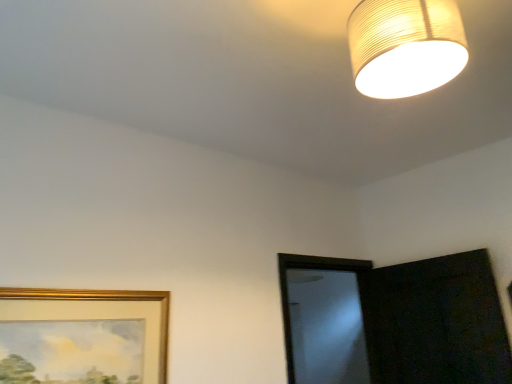
In order to face gold-framed picture at lower left, should I rotate leftwards or rightwards?

You should rotate left by 21.230 degrees.

Image resolution: width=512 pixels, height=384 pixels. What do you see at coordinates (106, 300) in the screenshot?
I see `gold-framed picture at lower left` at bounding box center [106, 300].

Measure the distance between point (11,289) and camera.

Point (11,289) is 1.40 meters away from camera.

You are a GUI agent. You are given a task and a screenshot of the screen. Output one action in this format:
    pyautogui.click(x=<x>, y=<y>)
    Task: Click on the gold-framed picture at lower left
    
    Given the screenshot: What is the action you would take?
    pyautogui.click(x=106, y=300)

I want to click on matte paper lampshade at upper right, so click(405, 46).

In order to face matte paper lampshade at upper right, should I rotate leftwards or rightwards?

Turn right by 18.548 degrees to look at matte paper lampshade at upper right.

What do you see at coordinates (405, 46) in the screenshot? I see `matte paper lampshade at upper right` at bounding box center [405, 46].

The width and height of the screenshot is (512, 384). Find the location of `gold-framed picture at lower left`. gold-framed picture at lower left is located at coordinates (106, 300).

Does matte paper lampshade at upper right appear on the left side of gold-framed picture at lower left?

In fact, matte paper lampshade at upper right is to the right of gold-framed picture at lower left.

Is matte paper lampshade at upper right positioned in front of gold-framed picture at lower left?

Yes, the depth of matte paper lampshade at upper right is less than that of gold-framed picture at lower left.

Does point (453, 60) come closer to viewer compared to point (56, 290)?

Yes, point (453, 60) is in front of point (56, 290).

From the image's perspective, does matte paper lampshade at upper right appear lower than gold-framed picture at lower left?

No, from the image's perspective, matte paper lampshade at upper right is not beneath gold-framed picture at lower left.

From a real-world perspective, who is located lower, matte paper lampshade at upper right or gold-framed picture at lower left?

In real-world perspective, gold-framed picture at lower left is lower.

Looking at this image, between matte paper lampshade at upper right and gold-framed picture at lower left, which one has larger width?

matte paper lampshade at upper right is wider.

Considering the sizes of objects matte paper lampshade at upper right and gold-framed picture at lower left in the image provided, who is taller, matte paper lampshade at upper right or gold-framed picture at lower left?

Standing taller between the two is gold-framed picture at lower left.

Considering the relative sizes of matte paper lampshade at upper right and gold-framed picture at lower left in the image provided, is matte paper lampshade at upper right smaller than gold-framed picture at lower left?

Actually, matte paper lampshade at upper right might be larger than gold-framed picture at lower left.

Choose the correct answer: Is matte paper lampshade at upper right inside gold-framed picture at lower left or outside it?

matte paper lampshade at upper right is located beyond the bounds of gold-framed picture at lower left.

Would you say matte paper lampshade at upper right is a long distance from gold-framed picture at lower left?

Indeed, matte paper lampshade at upper right is not near gold-framed picture at lower left.

Is matte paper lampshade at upper right oriented towards gold-framed picture at lower left?

No.

How distant is matte paper lampshade at upper right from gold-framed picture at lower left?

matte paper lampshade at upper right is 4.13 feet from gold-framed picture at lower left.

Identify the location of lamp in front of the gold-framed picture at lower left. (405, 46).

Which object is positioned more to the right, gold-framed picture at lower left or matte paper lampshade at upper right?

Positioned to the right is matte paper lampshade at upper right.

Between gold-framed picture at lower left and matte paper lampshade at upper right, which one is positioned in front?

matte paper lampshade at upper right is more forward.

Considering the points (157, 346) and (365, 59), which point is in front, point (157, 346) or point (365, 59)?

Point (365, 59)

Consider the image. From the image's perspective, is gold-framed picture at lower left above or below matte paper lampshade at upper right?

From the image's perspective, gold-framed picture at lower left appears below matte paper lampshade at upper right.

From a real-world perspective, is gold-framed picture at lower left positioned above or below matte paper lampshade at upper right?

From a real-world perspective, gold-framed picture at lower left is physically below matte paper lampshade at upper right.

Considering the sizes of gold-framed picture at lower left and matte paper lampshade at upper right in the image, is gold-framed picture at lower left wider or thinner than matte paper lampshade at upper right?

Considering their sizes, gold-framed picture at lower left looks slimmer than matte paper lampshade at upper right.

Between gold-framed picture at lower left and matte paper lampshade at upper right, which one has more height?

gold-framed picture at lower left is taller.

Consider the image. Considering the sizes of gold-framed picture at lower left and matte paper lampshade at upper right in the image, is gold-framed picture at lower left bigger or smaller than matte paper lampshade at upper right?

Considering their sizes, gold-framed picture at lower left takes up less space than matte paper lampshade at upper right.

Is matte paper lampshade at upper right completely or partially inside gold-framed picture at lower left?

No.

Are gold-framed picture at lower left and matte paper lampshade at upper right making contact?

No.

Does gold-framed picture at lower left turn towards matte paper lampshade at upper right?

No, gold-framed picture at lower left is not aimed at matte paper lampshade at upper right.

The image size is (512, 384). Identify the location of lamp located in front of the gold-framed picture at lower left. click(405, 46).

Where is `lamp above the gold-framed picture at lower left (from a real-world perspective)`? This screenshot has height=384, width=512. lamp above the gold-framed picture at lower left (from a real-world perspective) is located at coordinates (405, 46).

The image size is (512, 384). I want to click on picture frame behind the matte paper lampshade at upper right, so click(x=106, y=300).